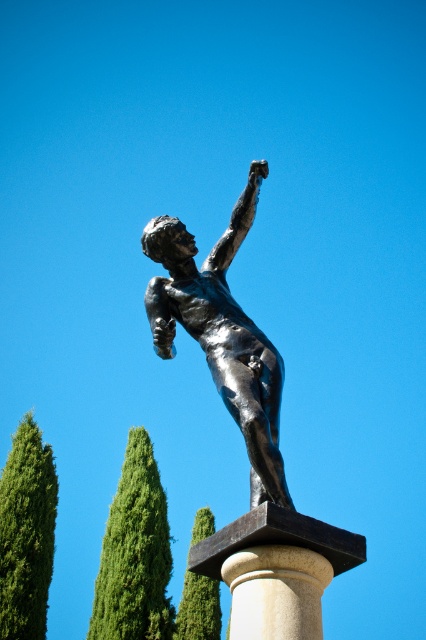
You are an art curator planning to move the shiny bronze statue at center and the white marble pillar at center to a new exhibition space. The entrance door is narrow, only allowing items up to 1.5 meters in width. Which object might not fit through the door based on their widths?

The shiny bronze statue at center has a greater width than the white marble pillar at center. Since the statue is wider, it might not fit through the 1.5 meter wide door if its width exceeds the limit, while the pillar could potentially fit.

You are standing in front of the bronze statue on the pedestal. You notice a point labeled at coordinates (135,554). What object is located at that point?

The point at coordinates (135,554) indicates a green leafy tree at center.